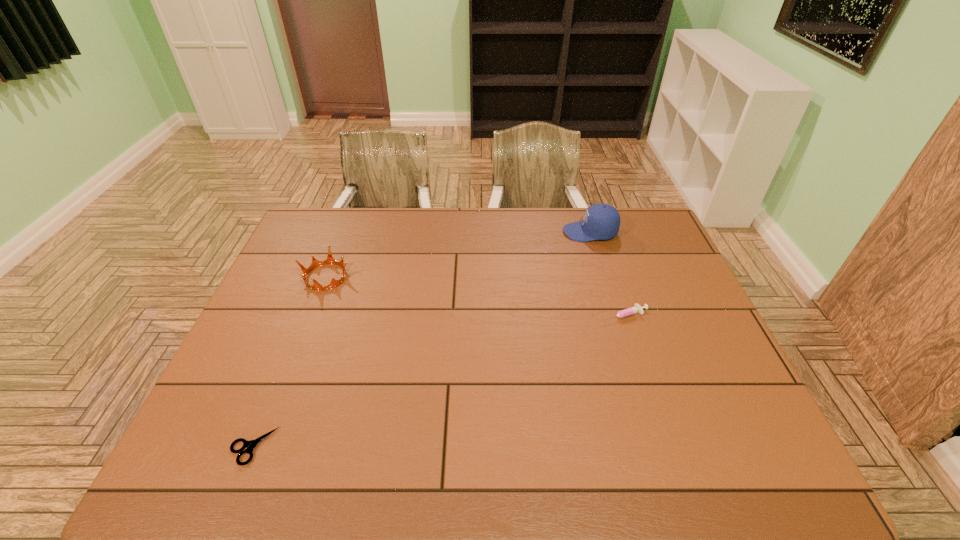
Locate an element on the screen. The width and height of the screenshot is (960, 540). free spot located on the front-facing side of the tallest object is located at coordinates (498, 232).

This screenshot has height=540, width=960. In order to click on vacant space situated on the back of the second farthest object in this screenshot , I will do `click(339, 244)`.

This screenshot has height=540, width=960. I want to click on vacant area situated on the front of the second shortest object, so click(x=641, y=370).

Image resolution: width=960 pixels, height=540 pixels. Find the location of `free region located on the back of the shears`. free region located on the back of the shears is located at coordinates (293, 346).

Where is `object present at the far edge`? The image size is (960, 540). object present at the far edge is located at coordinates pyautogui.click(x=601, y=221).

At what (x,y) coordinates should I click in order to perform the action: click on object positioned at the near edge. Please return your answer as a coordinate pair (x, y). This screenshot has height=540, width=960. Looking at the image, I should click on (250, 445).

Find the location of a particular element. crown at the left edge is located at coordinates (315, 263).

You are a GUI agent. You are given a task and a screenshot of the screen. Output one action in this format:
    pyautogui.click(x=<x>, y=<y>)
    Task: Click on the shears that is at the left edge
    The image size is (960, 540).
    Given the screenshot: What is the action you would take?
    pyautogui.click(x=250, y=445)

The height and width of the screenshot is (540, 960). I want to click on cap present at the right edge, so click(601, 221).

This screenshot has height=540, width=960. Identify the location of syringe that is positioned at the right edge. (637, 308).